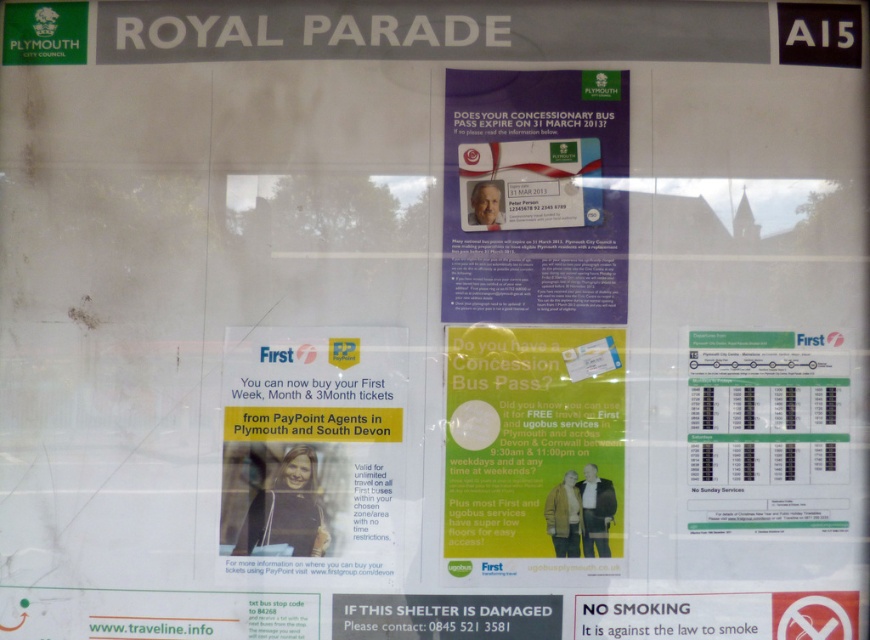
You are at the Royal Parade notice board and see both the blue paper poster at center and the green paper poster at center. Which poster is positioned to the right side?

The blue paper poster at center is positioned to the right of the green paper poster at center.

You are standing 2 meters away from the matte yellow paper at center. If you want to reach the purple notice titled

The purple notice titled